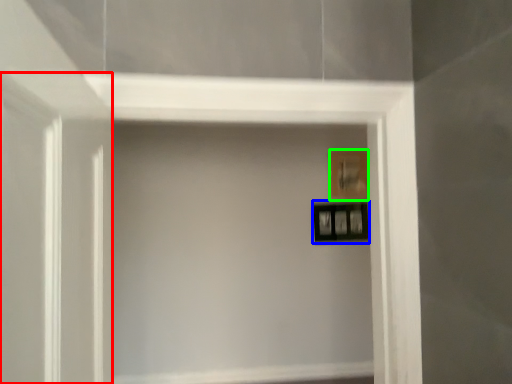
Question: Considering the real-world distances, which object is closest to glass door (highlighted by a red box)? picture frame (highlighted by a blue box) or picture frame (highlighted by a green box).

Choices:
 (A) picture frame
 (B) picture frame

Answer: (A)